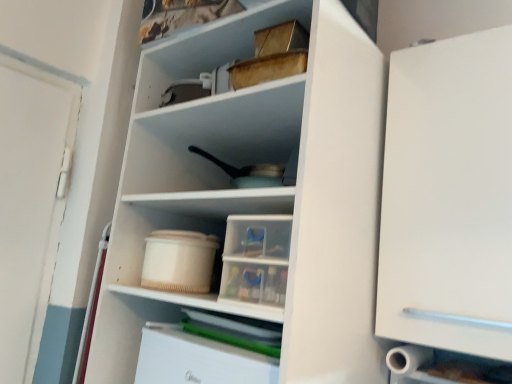
Question: From the image's perspective, is beige plastic container at center located beneath white plastic drawer at lower center, which is the 1th cabinetry from left to right?

Choices:
 (A) yes
 (B) no

Answer: (B)

Question: Is beige plastic container at center not close to white plastic drawer at lower center, which is the 1th cabinetry from left to right?

Choices:
 (A) no
 (B) yes

Answer: (A)

Question: Considering the relative positions of beige plastic container at center and white plastic drawer at lower center, which is the 1th cabinetry from left to right, in the image provided, is beige plastic container at center in front of white plastic drawer at lower center, which is the 1th cabinetry from left to right,?

Choices:
 (A) yes
 (B) no

Answer: (B)

Question: Can you confirm if beige plastic container at center is shorter than white plastic drawer at lower center, the 1th cabinetry when ordered from bottom to top?

Choices:
 (A) no
 (B) yes

Answer: (B)

Question: Is beige plastic container at center placed right next to white plastic drawer at lower center, the 2th cabinetry from the top?

Choices:
 (A) no
 (B) yes

Answer: (A)

Question: Is white matte cabinet at right, positioned as the first cabinetry in right-to-left order, in front of or behind wooden box at upper center in the image?

Choices:
 (A) behind
 (B) front

Answer: (B)

Question: Considering the positions of white matte cabinet at right, which is the 1th cabinetry from top to bottom, and wooden box at upper center in the image, is white matte cabinet at right, which is the 1th cabinetry from top to bottom, wider or thinner than wooden box at upper center?

Choices:
 (A) thin
 (B) wide

Answer: (A)

Question: Would you say white matte cabinet at right, marked as the second cabinetry in a left-to-right arrangement, is to the left or to the right of wooden box at upper center in the picture?

Choices:
 (A) right
 (B) left

Answer: (A)

Question: From a real-world perspective, relative to wooden box at upper center, is white matte cabinet at right, which is counted as the second cabinetry, starting from the bottom, vertically above or below?

Choices:
 (A) below
 (B) above

Answer: (A)

Question: Would you say white matte cabinet at right, which is the 1th cabinetry from top to bottom, is to the left or to the right of beige plastic container at center in the picture?

Choices:
 (A) left
 (B) right

Answer: (B)

Question: From the image's perspective, is white matte cabinet at right, marked as the second cabinetry in a left-to-right arrangement, above or below beige plastic container at center?

Choices:
 (A) above
 (B) below

Answer: (A)

Question: Choose the correct answer: Is white matte cabinet at right, marked as the second cabinetry in a left-to-right arrangement, inside beige plastic container at center or outside it?

Choices:
 (A) inside
 (B) outside

Answer: (B)

Question: In the image, is white matte cabinet at right, which is the 1th cabinetry from top to bottom, positioned in front of or behind beige plastic container at center?

Choices:
 (A) behind
 (B) front

Answer: (B)

Question: Considering the relative positions of beige plastic container at center and wooden box at upper center in the image provided, is beige plastic container at center to the left or to the right of wooden box at upper center?

Choices:
 (A) right
 (B) left

Answer: (B)

Question: Is beige plastic container at center inside or outside of wooden box at upper center?

Choices:
 (A) inside
 (B) outside

Answer: (B)